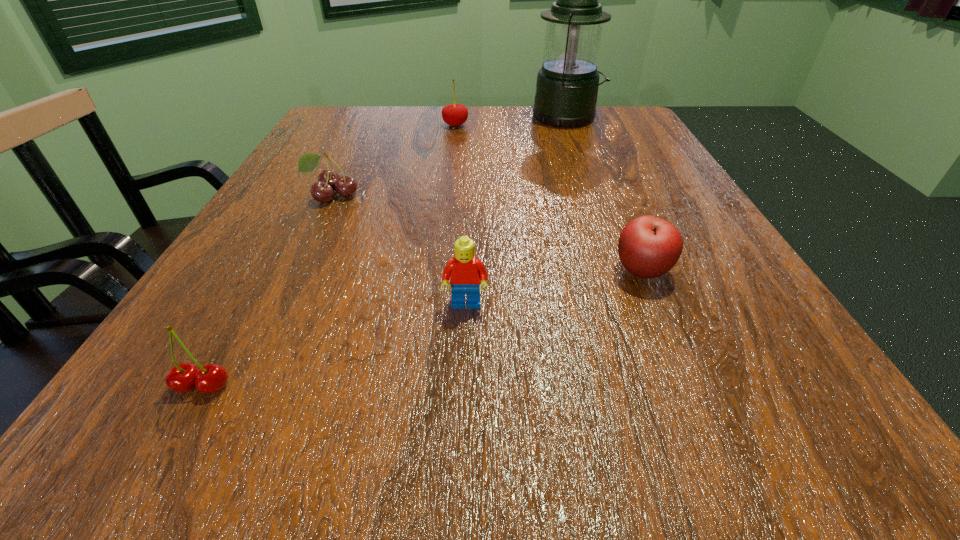
Find the location of `lantern`. lantern is located at coordinates (567, 84).

Identify the location of the tallest cherry. (454, 114).

Identify the location of the rightmost cherry. (454, 114).

Where is `Lego`? Lego is located at coordinates (464, 271).

I want to click on the fourth farthest object, so click(x=649, y=247).

I want to click on the nearest cherry, so click(x=211, y=378).

The height and width of the screenshot is (540, 960). Find the location of `the second farthest cherry`. the second farthest cherry is located at coordinates (329, 180).

Find the location of a particular element. The image size is (960, 540). blank space located 0.140m on the left of the tallest object is located at coordinates (478, 118).

Find the location of `free region located on the right of the tallest cherry`. free region located on the right of the tallest cherry is located at coordinates (533, 125).

This screenshot has width=960, height=540. Find the location of `free point located on the face of the fifth farthest object`. free point located on the face of the fifth farthest object is located at coordinates (461, 447).